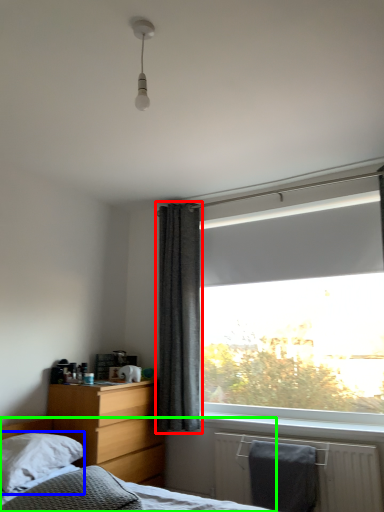
Question: Based on their relative distances, which object is farther from curtain (highlighted by a red box)? Choose from pillow (highlighted by a blue box) and bed (highlighted by a green box).

Choices:
 (A) pillow
 (B) bed

Answer: (B)